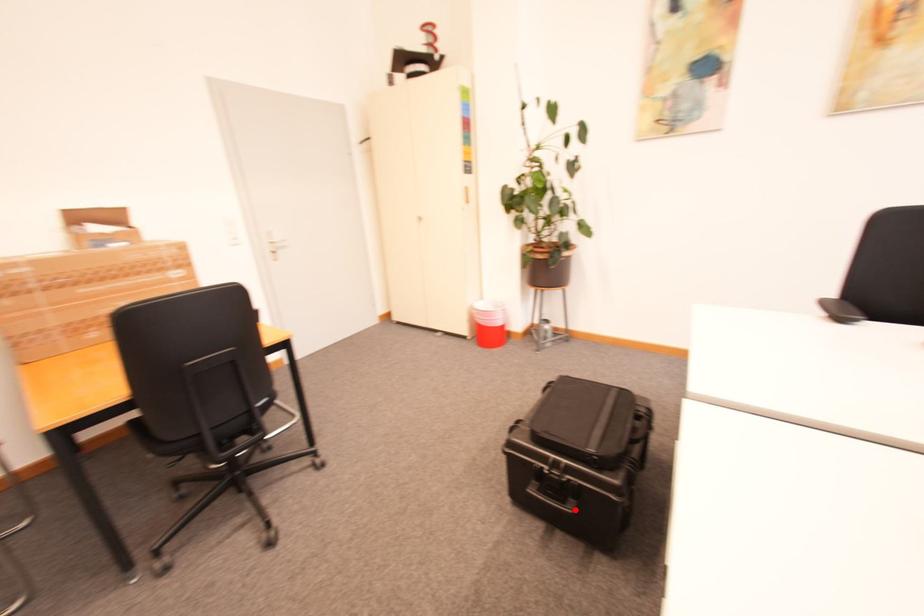
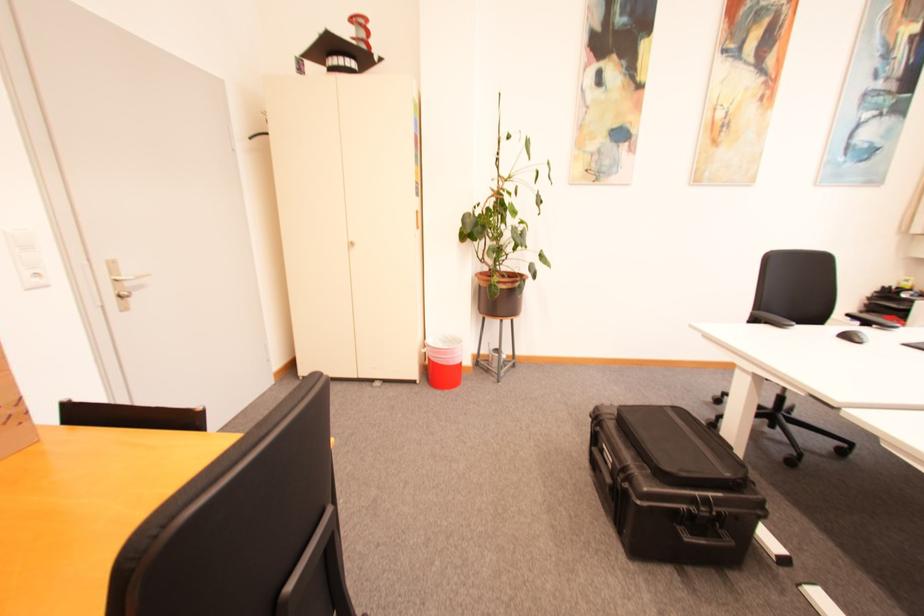
Locate, in the second image, the point that corresponds to the highlighted location in the first image.

(736, 541)